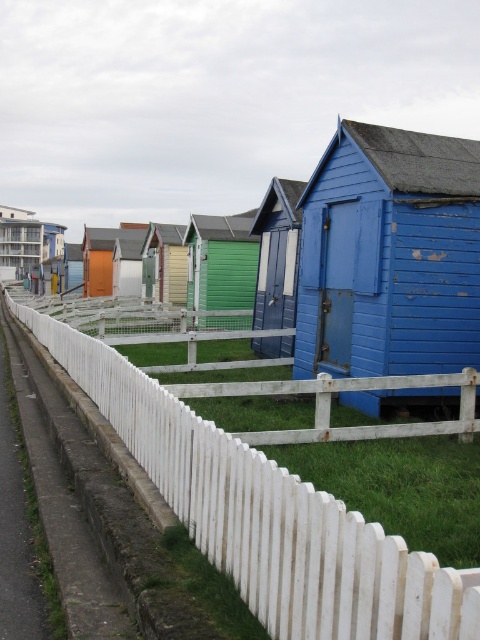
You are standing at the paved path in front of the beach huts. There are two points marked in the image. The first point is at coordinate point[335,506] and the second point is at coordinate point[382,176]. Which point is nearer to you?

Point[335,506] is closer to the camera than point[382,176], so the first point is nearer to you.

You are standing at the entrance of the beach huts and want to know where the white picket fence at lower left is positioned relative to the paved path. Can you determine its location based on the coordinates provided?

The white picket fence at lower left is located at coordinates point (266, 515), which places it near the lower left area of the image, likely close to the entrance where the paved path begins. This coordinate suggests it is positioned to the left side of the path, possibly bordering the grassy area adjacent to the beach huts.

You are a tour guide leading a group along the paved path in front of the beach huts. You need to move a 10 meter long banner between the green painted wood hut at center and the orange wood cabin at center. Is there enough space for the banner to fit between them?

The green painted wood hut at center and orange wood cabin at center are 10.22 meters apart from each other. Since the banner is 10 meters long, there is enough space for the banner to fit between them as the distance between the huts is slightly longer than the banner.